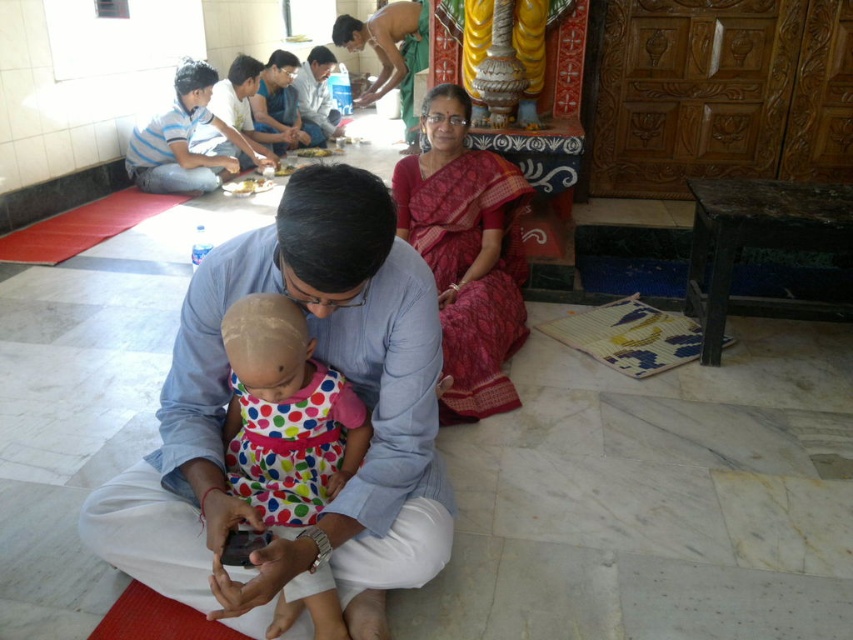
Question: Which point is farther to the camera?

Choices:
 (A) white matte food at center
 (B) polka dot fabric dress at center
 (C) blue cotton shirt at center

Answer: (A)

Question: Is polka dot fabric dress at center smaller than white matte food at center?

Choices:
 (A) no
 (B) yes

Answer: (A)

Question: Which point is closer to the camera?

Choices:
 (A) pyautogui.click(x=521, y=182)
 (B) pyautogui.click(x=216, y=449)
 (C) pyautogui.click(x=299, y=419)
 (D) pyautogui.click(x=230, y=189)

Answer: (B)

Question: Is red silk saree at center to the left of white matte food at center from the viewer's perspective?

Choices:
 (A) no
 (B) yes

Answer: (A)

Question: Is polka dot fabric dress at center positioned behind white matte food at center?

Choices:
 (A) yes
 (B) no

Answer: (B)

Question: Which of these objects is positioned farthest from the polka dot fabric dress at center?

Choices:
 (A) blue cotton shirt at center
 (B) red silk saree at center

Answer: (B)